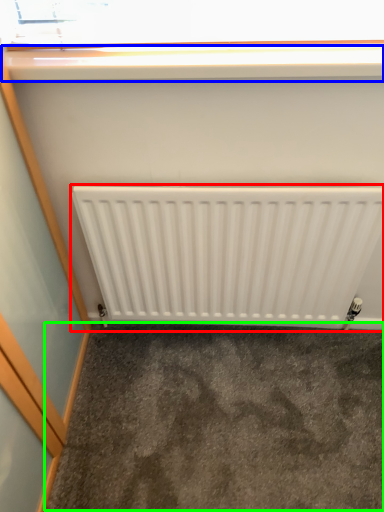
Question: Considering the real-world distances, which object is closest to radiator (highlighted by a red box)? window sill (highlighted by a blue box) or concrete (highlighted by a green box).

Choices:
 (A) window sill
 (B) concrete

Answer: (B)